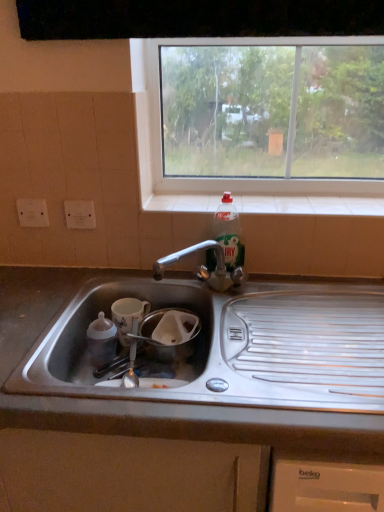
Question: Is white tile at upper center a part of clear glass window at upper center?

Choices:
 (A) yes
 (B) no

Answer: (B)

Question: Is clear glass window at upper center turned away from white tile at upper center?

Choices:
 (A) no
 (B) yes

Answer: (A)

Question: Is clear glass window at upper center far from white tile at upper center?

Choices:
 (A) no
 (B) yes

Answer: (A)

Question: Does clear glass window at upper center have a greater width compared to white tile at upper center?

Choices:
 (A) yes
 (B) no

Answer: (B)

Question: From the image's perspective, is clear glass window at upper center below white tile at upper center?

Choices:
 (A) yes
 (B) no

Answer: (B)

Question: Does clear glass window at upper center have a lesser height compared to white tile at upper center?

Choices:
 (A) yes
 (B) no

Answer: (B)

Question: Does satin steel sink at lower center lie behind white glossy mug at lower left?

Choices:
 (A) yes
 (B) no

Answer: (B)

Question: Is white glossy mug at lower left surrounded by satin steel sink at lower center?

Choices:
 (A) yes
 (B) no

Answer: (A)

Question: Is satin steel sink at lower center taller than white glossy mug at lower left?

Choices:
 (A) yes
 (B) no

Answer: (A)

Question: Is satin steel sink at lower center shorter than white glossy mug at lower left?

Choices:
 (A) no
 (B) yes

Answer: (A)

Question: From the image's perspective, is satin steel sink at lower center on white glossy mug at lower left?

Choices:
 (A) no
 (B) yes

Answer: (A)

Question: Does satin steel sink at lower center have a larger size compared to white glossy mug at lower left?

Choices:
 (A) no
 (B) yes

Answer: (B)

Question: From the image's perspective, is translucent plastic bottle at upper right located beneath white glossy mug at lower left?

Choices:
 (A) yes
 (B) no

Answer: (B)